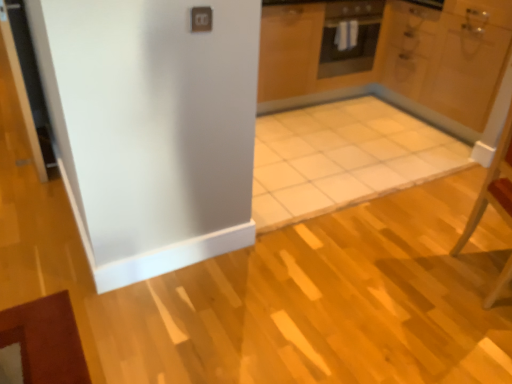
Question: Is black matte oven at upper center bigger than white glossy door at upper right?

Choices:
 (A) yes
 (B) no

Answer: (B)

Question: From the image's perspective, is black matte oven at upper center under white glossy door at upper right?

Choices:
 (A) yes
 (B) no

Answer: (B)

Question: From a real-world perspective, is black matte oven at upper center physically above white glossy door at upper right?

Choices:
 (A) yes
 (B) no

Answer: (A)

Question: Is black matte oven at upper center touching white glossy door at upper right?

Choices:
 (A) yes
 (B) no

Answer: (B)

Question: Considering the relative sizes of black matte oven at upper center and white glossy door at upper right in the image provided, is black matte oven at upper center smaller than white glossy door at upper right?

Choices:
 (A) no
 (B) yes

Answer: (B)

Question: In terms of width, does wooden chair at right look wider or thinner when compared to white glossy door at upper right?

Choices:
 (A) thin
 (B) wide

Answer: (A)

Question: From a real-world perspective, is wooden chair at right above or below white glossy door at upper right?

Choices:
 (A) above
 (B) below

Answer: (B)

Question: Is wooden chair at right taller or shorter than white glossy door at upper right?

Choices:
 (A) tall
 (B) short

Answer: (B)

Question: In terms of size, does wooden chair at right appear bigger or smaller than white glossy door at upper right?

Choices:
 (A) big
 (B) small

Answer: (B)

Question: Considering their positions, is black matte oven at upper center located in front of or behind wooden chair at right?

Choices:
 (A) behind
 (B) front

Answer: (A)

Question: Based on their positions, is black matte oven at upper center located to the left or right of wooden chair at right?

Choices:
 (A) left
 (B) right

Answer: (A)

Question: From a real-world perspective, is black matte oven at upper center above or below wooden chair at right?

Choices:
 (A) below
 (B) above

Answer: (B)

Question: Is black matte oven at upper center inside the boundaries of wooden chair at right, or outside?

Choices:
 (A) inside
 (B) outside

Answer: (B)

Question: Does point (463, 46) appear closer or farther from the camera than point (362, 34)?

Choices:
 (A) closer
 (B) farther

Answer: (A)

Question: Relative to black matte oven at upper center, is white glossy door at upper right in front or behind?

Choices:
 (A) behind
 (B) front

Answer: (B)